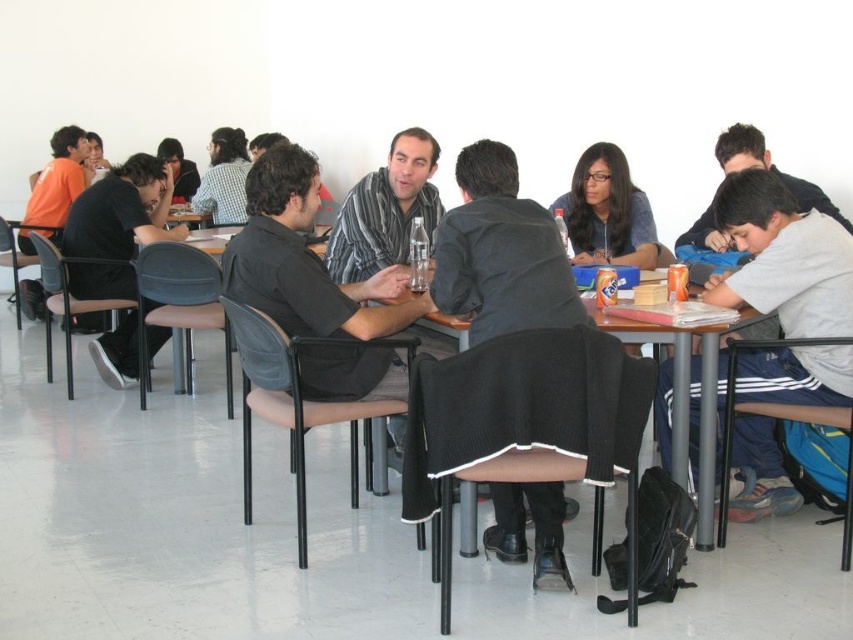
Question: Which of the following is the farthest from the observer?

Choices:
 (A) (666, 250)
 (B) (515, 540)
 (C) (131, 236)
 (D) (630, 326)

Answer: (C)

Question: Which point appears farthest from the camera in this image?

Choices:
 (A) (590, 156)
 (B) (659, 410)
 (C) (502, 202)
 (D) (689, 352)

Answer: (A)

Question: From the image, what is the correct spatial relationship of dark gray sweater at center in relation to wooden table at center?

Choices:
 (A) above
 (B) below

Answer: (A)

Question: Does gray cotton shirt at right lie in front of matte gray sweater at center?

Choices:
 (A) yes
 (B) no

Answer: (A)

Question: Which of the following is the farthest from the observer?

Choices:
 (A) gray striped shirt at center
 (B) gray cotton shirt at right
 (C) black shirt at left

Answer: (A)

Question: In this image, where is black shirt at left located relative to matte gray sweater at center?

Choices:
 (A) left
 (B) right

Answer: (A)